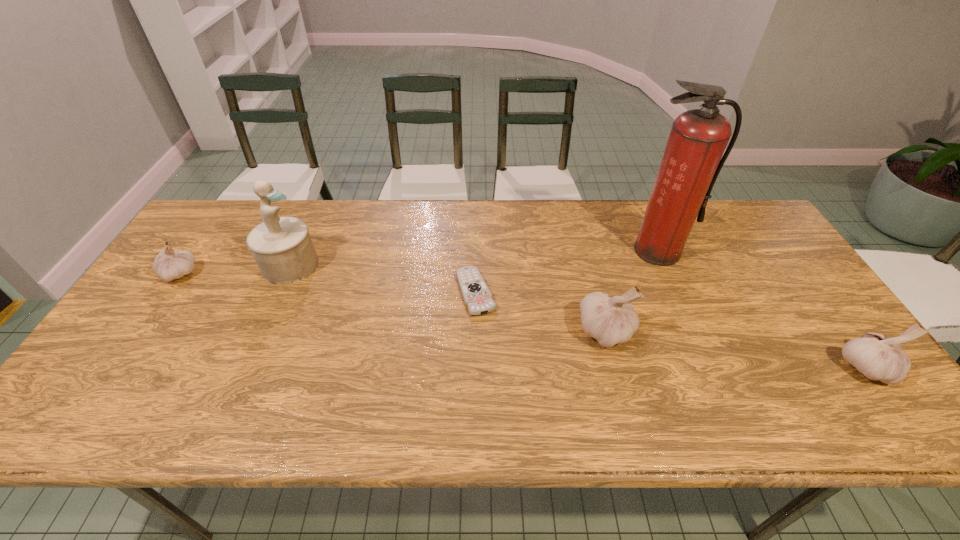
At what (x,y) coordinates should I click in order to perform the action: click on object situated at the right edge. Please return your answer as a coordinate pair (x, y). The height and width of the screenshot is (540, 960). Looking at the image, I should click on (877, 357).

You are a GUI agent. You are given a task and a screenshot of the screen. Output one action in this format:
    pyautogui.click(x=<x>, y=<y>)
    Task: Click on the object located in the near right corner section of the desktop
    Image resolution: width=960 pixels, height=540 pixels.
    Given the screenshot: What is the action you would take?
    pyautogui.click(x=877, y=357)

You are a GUI agent. You are given a task and a screenshot of the screen. Output one action in this format:
    pyautogui.click(x=<x>, y=<y>)
    Task: Click on the vacant space at the far edge of the desktop
    
    Given the screenshot: What is the action you would take?
    pyautogui.click(x=240, y=243)

The width and height of the screenshot is (960, 540). What are the coordinates of `vacant space at the near edge of the desktop` in the screenshot? It's located at (531, 384).

Where is `vacant region at the left edge of the desktop`? The width and height of the screenshot is (960, 540). vacant region at the left edge of the desktop is located at coordinates (143, 321).

Find the location of a particular element. The width and height of the screenshot is (960, 540). vacant area at the right edge of the desktop is located at coordinates (769, 307).

Image resolution: width=960 pixels, height=540 pixels. In the image, there is a desktop. Find the location of `vacant area at the far left corner`. vacant area at the far left corner is located at coordinates (230, 227).

Image resolution: width=960 pixels, height=540 pixels. I want to click on free location at the near right corner of the desktop, so click(x=799, y=370).

I want to click on empty location between the rightmost garlic and the second garlic from left to right, so click(735, 350).

Identify the location of vacant area between the figurine and the second object from right to left. (474, 258).